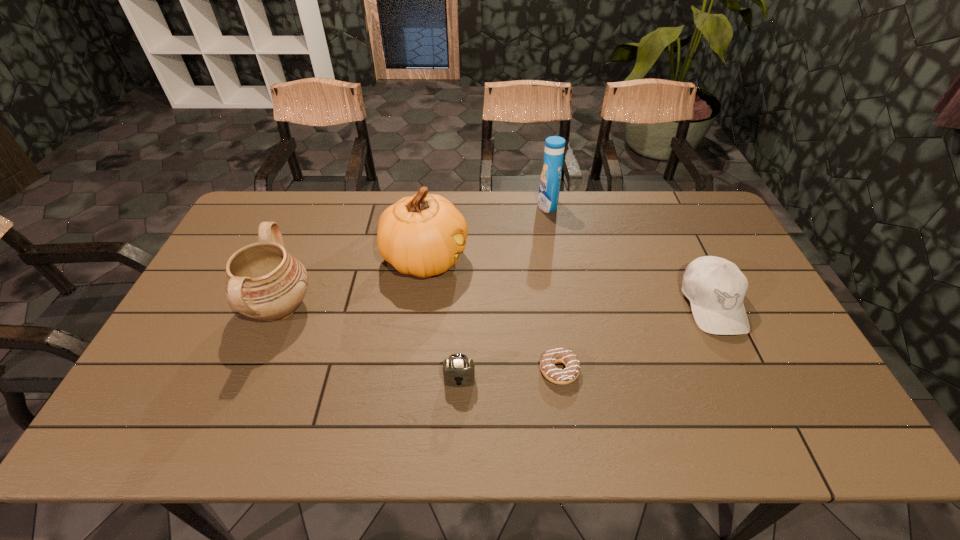
Where is `vacant region between the fifth tallest object and the rightmost object`? vacant region between the fifth tallest object and the rightmost object is located at coordinates (586, 342).

This screenshot has height=540, width=960. Find the location of `free area in between the pumpkin and the farthest object`. free area in between the pumpkin and the farthest object is located at coordinates click(x=486, y=232).

You are a GUI agent. You are given a task and a screenshot of the screen. Output one action in this format:
    pyautogui.click(x=<x>, y=<y>)
    Task: Click on the object identified as the closest to the urn
    
    Given the screenshot: What is the action you would take?
    pyautogui.click(x=422, y=235)

Choose which object is the third nearest neighbor to the farthest object. Please provide its 2D coordinates. Your answer should be formatted as a tuple, i.e. [(x, y)], where the tuple contains the x and y coordinates of a point satisfying the conditions above.

[(555, 375)]

Find the location of a particular element. The width and height of the screenshot is (960, 540). vacant space that satisfies the following two spatial constraints: 1. on the front-facing side of the farthest object; 2. at the front of the fifth tallest object near the keyhole is located at coordinates (578, 379).

Where is `free space that satisfies the following two spatial constraints: 1. on the front face of the shortest object; 2. on the left side of the pumpkin`? free space that satisfies the following two spatial constraints: 1. on the front face of the shortest object; 2. on the left side of the pumpkin is located at coordinates (411, 370).

In order to click on free space in the image that satisfies the following two spatial constraints: 1. on the front-facing side of the leftmost object; 2. on the left side of the shortest object in this screenshot , I will do `click(253, 370)`.